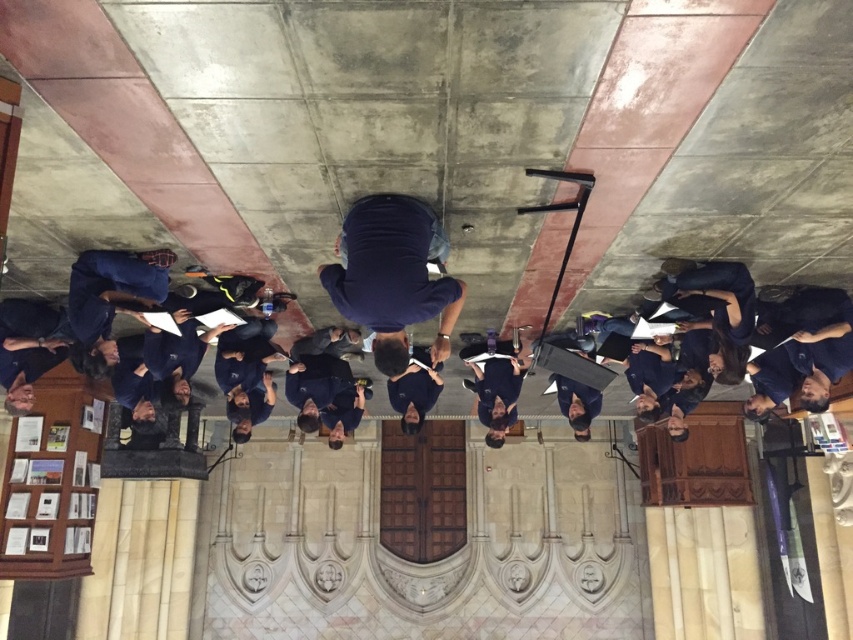
Does dark blue shirt at center appear on the left side of dark blue uniform at center?

Indeed, dark blue shirt at center is positioned on the left side of dark blue uniform at center.

Is dark blue shirt at center thinner than dark blue uniform at center?

In fact, dark blue shirt at center might be wider than dark blue uniform at center.

Which is in front, point (345, 259) or point (473, 372)?

Positioned in front is point (345, 259).

What are the coordinates of `dark blue shirt at center` in the screenshot? It's located at (392, 275).